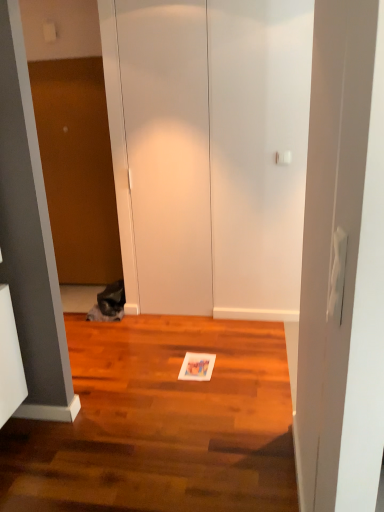
The image size is (384, 512). What are the coordinates of `vacant space underneath white matte door at center (from a real-world perspective)` in the screenshot? It's located at (179, 316).